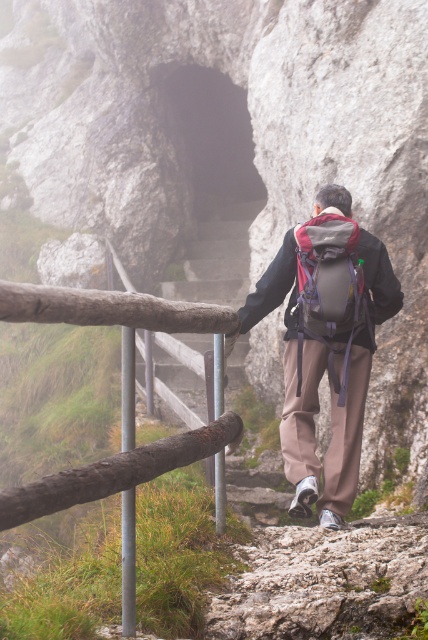
You are a hiker trying to navigate through the rocky staircase. You see the matte gray backpack at center and the brown wooden fence at left. Which object is closer to you as you face the staircase?

The matte gray backpack at center is closer to you because the brown wooden fence at left is behind it.

You are the hiker in the image and want to reach the top of the staircase. Which point, point (x=332, y=449) or point (x=326, y=278), is closer to your current position?

Point (x=326, y=278) is closer to your current position because it is in front of point (x=332, y=449).